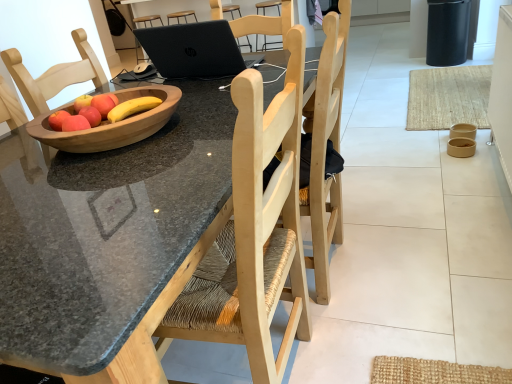
This screenshot has width=512, height=384. What are the coordinates of `free space in front of wooden bowl at left, which is the first bowl in left-to-right order` in the screenshot? It's located at (102, 193).